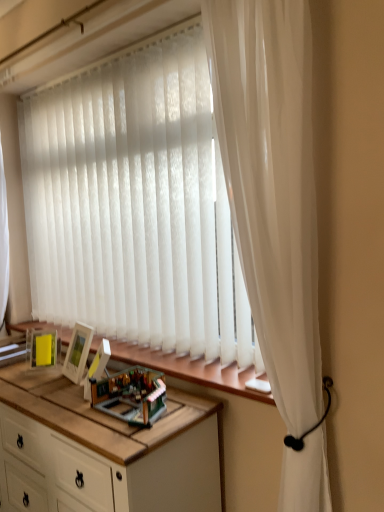
Question: Which is correct: white wood cabinet at center is inside translucent plastic toy at center, or outside of it?

Choices:
 (A) inside
 (B) outside

Answer: (B)

Question: In terms of width, does white wood cabinet at center look wider or thinner when compared to translucent plastic toy at center?

Choices:
 (A) wide
 (B) thin

Answer: (A)

Question: Which is farther from the white wood cabinet at center?

Choices:
 (A) wooden at lower center
 (B) translucent plastic toy at center
 (C) white sheer curtain at right

Answer: (C)

Question: Estimate the real-world distances between objects in this image. Which object is farther from the white sheer curtain at right?

Choices:
 (A) white wood cabinet at center
 (B) wooden at lower center
 (C) translucent plastic toy at center

Answer: (A)